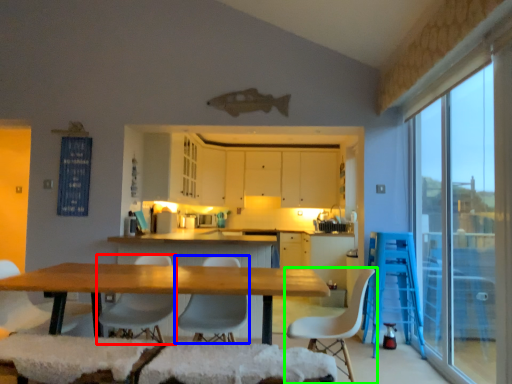
Question: Which object is positioned farthest from chair (highlighted by a red box)? Select from chair (highlighted by a blue box) and chair (highlighted by a green box).

Choices:
 (A) chair
 (B) chair

Answer: (B)